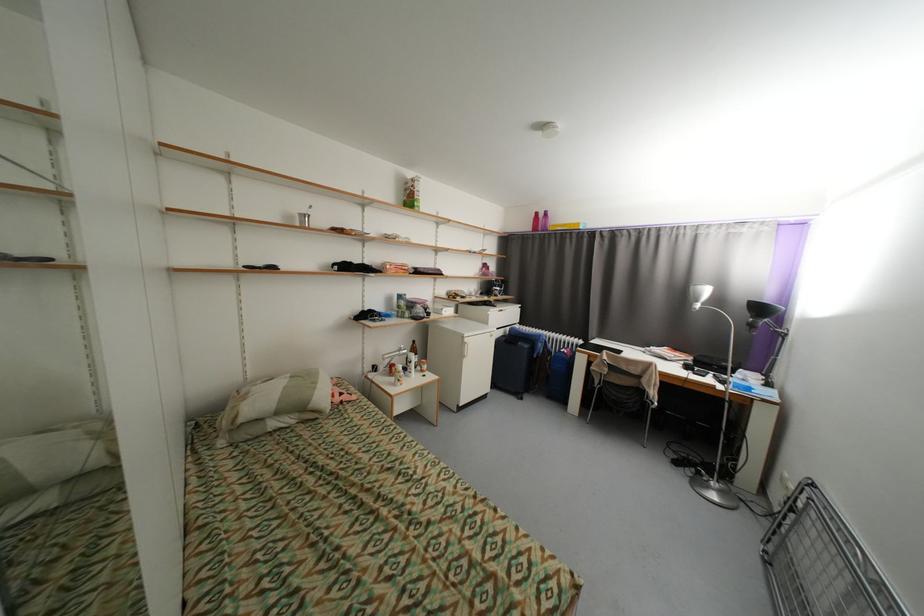
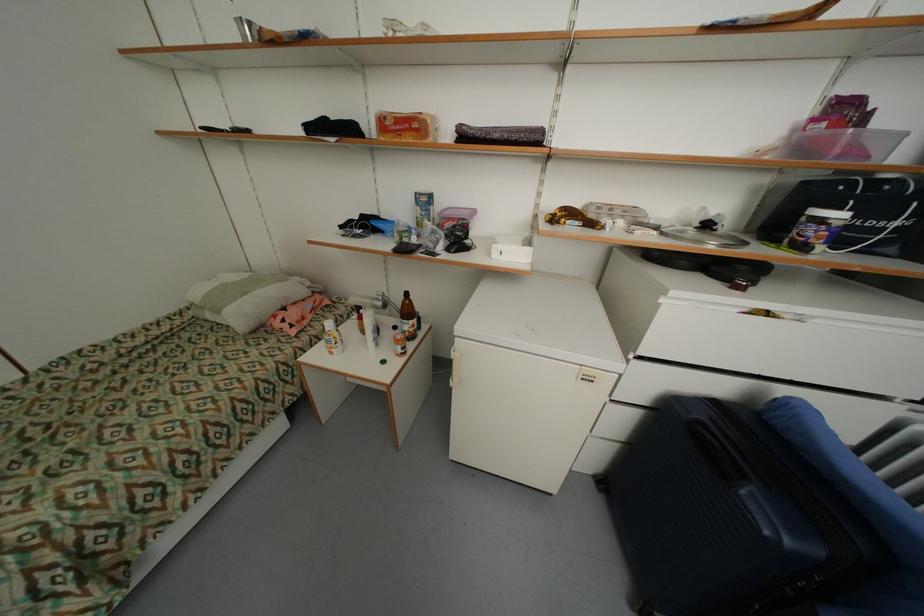
The point at [410,270] is marked in the first image. Where is the corresponding point in the second image?

(421, 126)